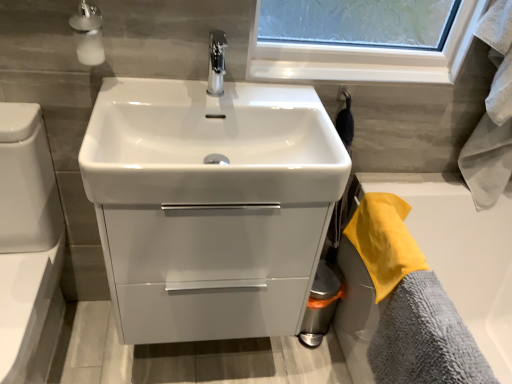
Question: Is yellow terry cloth towel at right, which appears as the 1th bath towel when viewed from the top, facing away from gray microfiber towel at lower right, marked as the 1th bath towel in a bottom-to-top arrangement?

Choices:
 (A) no
 (B) yes

Answer: (A)

Question: From the image's perspective, is yellow terry cloth towel at right, which appears as the 1th bath towel when viewed from the top, over gray microfiber towel at lower right, marked as the 1th bath towel in a bottom-to-top arrangement?

Choices:
 (A) no
 (B) yes

Answer: (B)

Question: Considering the relative positions of yellow terry cloth towel at right, placed as the 2th bath towel when sorted from bottom to top, and gray microfiber towel at lower right, the 2th bath towel from the top, in the image provided, is yellow terry cloth towel at right, placed as the 2th bath towel when sorted from bottom to top, to the left of gray microfiber towel at lower right, the 2th bath towel from the top, from the viewer's perspective?

Choices:
 (A) no
 (B) yes

Answer: (B)

Question: Can you confirm if yellow terry cloth towel at right, placed as the 2th bath towel when sorted from bottom to top, is thinner than gray microfiber towel at lower right, marked as the 1th bath towel in a bottom-to-top arrangement?

Choices:
 (A) no
 (B) yes

Answer: (A)

Question: Is yellow terry cloth towel at right, which appears as the 1th bath towel when viewed from the top, not inside gray microfiber towel at lower right, the 2th bath towel from the top?

Choices:
 (A) no
 (B) yes

Answer: (B)

Question: Would you say gray microfiber towel at lower right, the 2th bath towel from the top, is to the left or to the right of yellow terry cloth towel at right, which appears as the 1th bath towel when viewed from the top, in the picture?

Choices:
 (A) right
 (B) left

Answer: (A)

Question: In terms of size, does gray microfiber towel at lower right, marked as the 1th bath towel in a bottom-to-top arrangement, appear bigger or smaller than yellow terry cloth towel at right, placed as the 2th bath towel when sorted from bottom to top?

Choices:
 (A) big
 (B) small

Answer: (A)

Question: From a real-world perspective, is gray microfiber towel at lower right, marked as the 1th bath towel in a bottom-to-top arrangement, positioned above or below yellow terry cloth towel at right, placed as the 2th bath towel when sorted from bottom to top?

Choices:
 (A) below
 (B) above

Answer: (A)

Question: From the image's perspective, is gray microfiber towel at lower right, the 2th bath towel from the top, located above or below yellow terry cloth towel at right, which appears as the 1th bath towel when viewed from the top?

Choices:
 (A) below
 (B) above

Answer: (A)

Question: Relative to gray microfiber towel at lower right, the 2th bath towel from the top, is white glossy toilet bowl at lower left in front or behind?

Choices:
 (A) behind
 (B) front

Answer: (B)

Question: Looking at their shapes, would you say white glossy toilet bowl at lower left is wider or thinner than gray microfiber towel at lower right, marked as the 1th bath towel in a bottom-to-top arrangement?

Choices:
 (A) thin
 (B) wide

Answer: (B)

Question: Is point (2, 370) closer or farther from the camera than point (400, 296)?

Choices:
 (A) closer
 (B) farther

Answer: (A)

Question: From a real-world perspective, is white glossy toilet bowl at lower left above or below gray microfiber towel at lower right, marked as the 1th bath towel in a bottom-to-top arrangement?

Choices:
 (A) above
 (B) below

Answer: (B)

Question: Is yellow terry cloth towel at right, placed as the 2th bath towel when sorted from bottom to top, wider or thinner than white glossy toilet bowl at lower left?

Choices:
 (A) thin
 (B) wide

Answer: (A)

Question: From the image's perspective, is yellow terry cloth towel at right, which appears as the 1th bath towel when viewed from the top, above or below white glossy toilet bowl at lower left?

Choices:
 (A) above
 (B) below

Answer: (A)